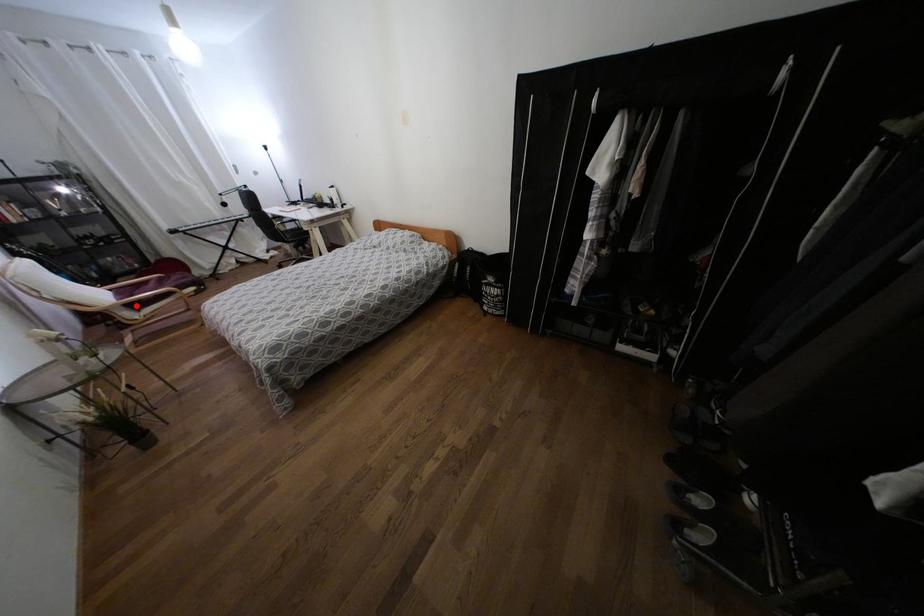
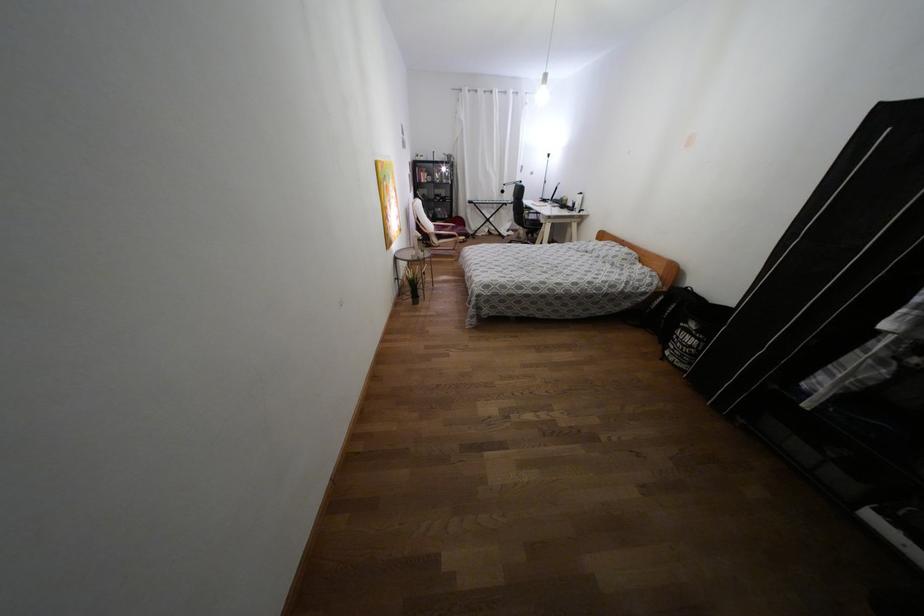
Question: I am providing you with two images of the same scene from different viewpoints. Given a red point in image1, look at the same physical point in image2. Is it:

Choices:
 (A) Closer to the viewpoint
 (B) Farther from the viewpoint

Answer: (A)